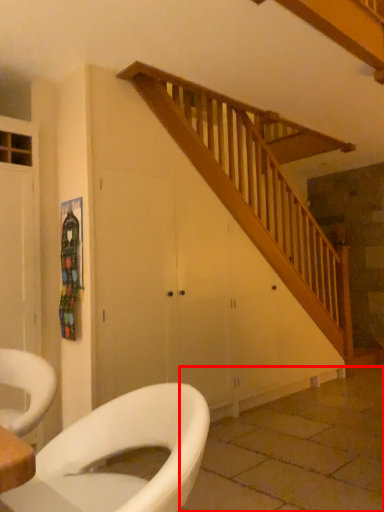
Question: From the image's perspective, where is tile (annotated by the red box) located relative to toilet?

Choices:
 (A) above
 (B) below

Answer: (B)